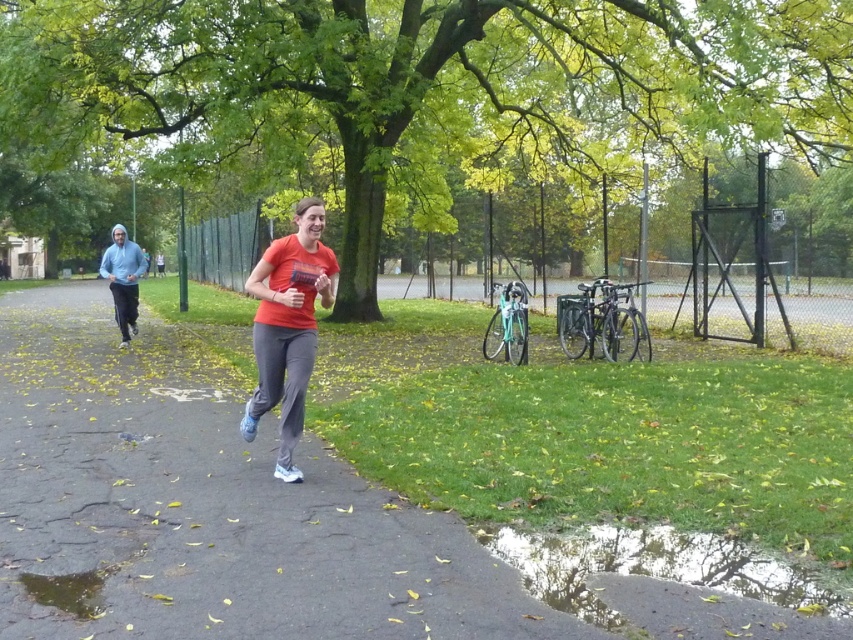
Can you confirm if transparent water at lower center is taller than light blue hoodie at left?

No.

Can you confirm if transparent water at lower center is positioned to the left of light blue hoodie at left?

In fact, transparent water at lower center is to the right of light blue hoodie at left.

Is point (795, 589) farther from camera compared to point (103, 275)?

No, (795, 589) is in front of (103, 275).

Locate an element on the screen. transparent water at lower center is located at coordinates (654, 566).

Consider the image. Does smooth asphalt path at center have a larger size compared to transparent water at lower center?

Yes, smooth asphalt path at center is bigger than transparent water at lower center.

Which is more to the right, smooth asphalt path at center or transparent water at lower center?

Positioned to the right is transparent water at lower center.

Who is more distant from viewer, (20, 348) or (585, 561)?

The point (20, 348) is behind.

Where is `smooth asphalt path at center`? This screenshot has height=640, width=853. smooth asphalt path at center is located at coordinates (206, 508).

Is transparent water at lower center closer to camera compared to orange matte shirt at center?

That is True.

Who is positioned more to the right, transparent water at lower center or orange matte shirt at center?

transparent water at lower center

Is point (849, 593) positioned behind point (256, 356)?

No.

This screenshot has height=640, width=853. I want to click on transparent water at lower center, so click(x=654, y=566).